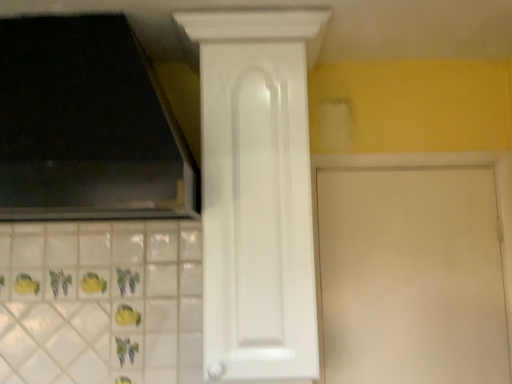
Question: From the image's perspective, is white matte door at center, the first door positioned from the right, located above or below white glossy cabinet door at center, marked as the second door in a right-to-left arrangement?

Choices:
 (A) below
 (B) above

Answer: (A)

Question: Is white matte door at center, positioned as the 2th door in left-to-right order, bigger or smaller than white glossy cabinet door at center, marked as the second door in a right-to-left arrangement?

Choices:
 (A) small
 (B) big

Answer: (A)

Question: Considering the positions of point (365, 190) and point (253, 11), is point (365, 190) closer or farther from the camera than point (253, 11)?

Choices:
 (A) closer
 (B) farther

Answer: (B)

Question: Is white glossy cabinet door at center, marked as the second door in a right-to-left arrangement, situated inside white matte door at center, positioned as the 2th door in left-to-right order, or outside?

Choices:
 (A) outside
 (B) inside

Answer: (A)

Question: Visually, is white glossy cabinet door at center, the 1th door in the left-to-right sequence, positioned to the left or to the right of white matte door at center, the first door positioned from the right?

Choices:
 (A) right
 (B) left

Answer: (B)

Question: In the image, is white glossy cabinet door at center, the 1th door in the left-to-right sequence, positioned in front of or behind white matte door at center, positioned as the 2th door in left-to-right order?

Choices:
 (A) front
 (B) behind

Answer: (A)

Question: Looking at the image, does white glossy cabinet door at center, marked as the second door in a right-to-left arrangement, seem bigger or smaller compared to white matte door at center, positioned as the 2th door in left-to-right order?

Choices:
 (A) big
 (B) small

Answer: (A)